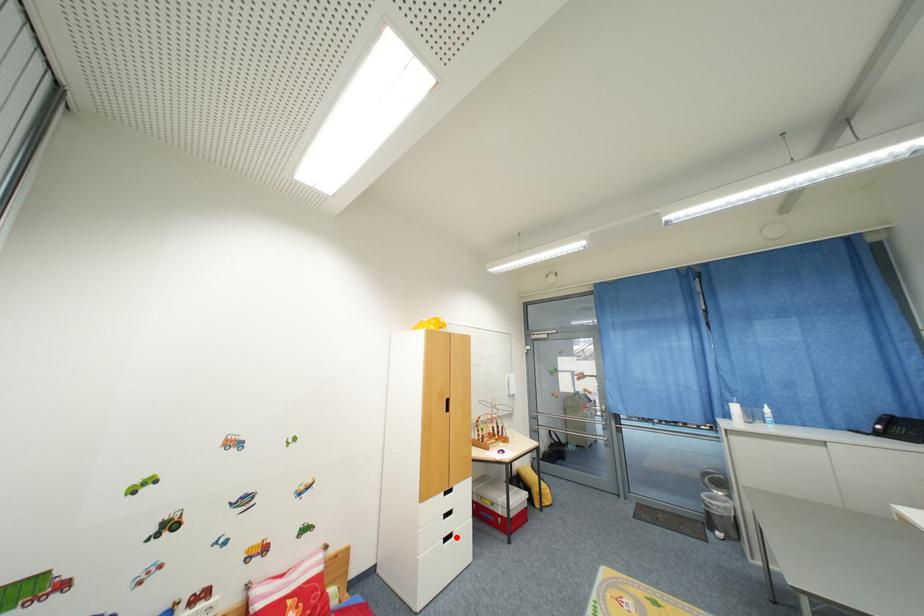
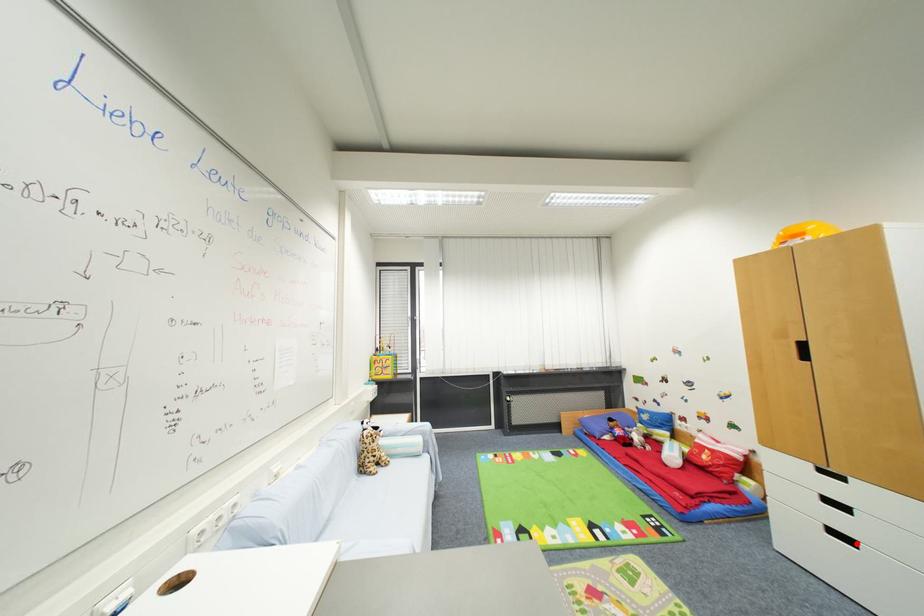
I am providing you with two images of the same scene from different viewpoints. A red point is marked on the first image and another point is marked on the second image. Are the points marked in image1 and image2 representing the same 3D position?

Yes